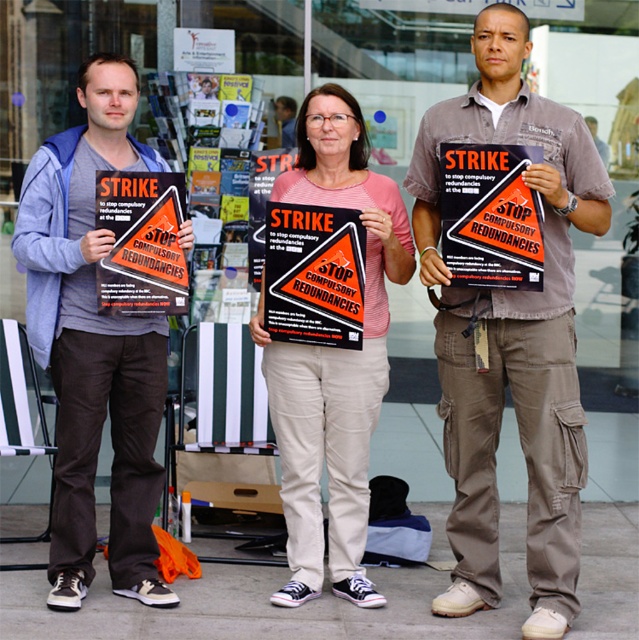
Question: Estimate the real-world distances between objects in this image. Which object is farther from the orange paper poster at center?

Choices:
 (A) orange paper sign at center
 (B) khaki cargo pants at center
 (C) smooth brown hair at center

Answer: (C)

Question: Which point is farther from the camera taking this photo?

Choices:
 (A) (504, 276)
 (B) (289, 113)
 (C) (535, 307)

Answer: (B)

Question: In this image, where is matte pink shirt at center located relative to smooth brown hair at center?

Choices:
 (A) right
 (B) left

Answer: (A)

Question: Is orange paper sign at center closer to the viewer compared to orange paper poster at center?

Choices:
 (A) no
 (B) yes

Answer: (B)

Question: Among these objects, which one is nearest to the camera?

Choices:
 (A) khaki cargo pants at center
 (B) matte pink shirt at center
 (C) orange paper poster at center
 (D) orange paper sign at center

Answer: (A)

Question: Does matte pink shirt at center appear on the right side of orange paper poster at center?

Choices:
 (A) no
 (B) yes

Answer: (B)